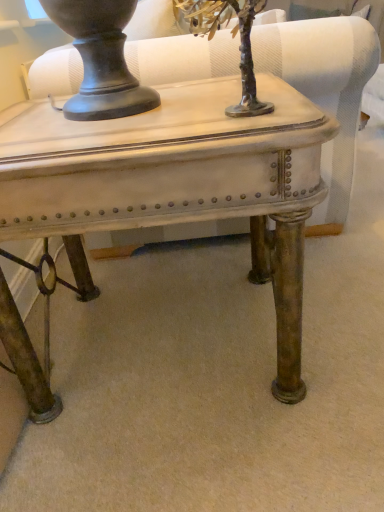
What do you see at coordinates (233, 37) in the screenshot? I see `metallic silver tree at upper center` at bounding box center [233, 37].

I want to click on metallic silver tree at upper center, so click(233, 37).

Is matte white swivel chair at center not close to metallic silver tree at upper center?

Actually, matte white swivel chair at center and metallic silver tree at upper center are a little close together.

From a real-world perspective, which object rests below the other?

matte white swivel chair at center.

From the image's perspective, which is above, matte white swivel chair at center or metallic silver tree at upper center?

From the image's view, matte white swivel chair at center is above.

Measure the distance between matte white swivel chair at center and metallic silver tree at upper center.

matte white swivel chair at center and metallic silver tree at upper center are 11.87 inches apart.

Is metallic silver tree at upper center turned away from matte white table at center?

No, matte white table at center is not at the back of metallic silver tree at upper center.

Is metallic silver tree at upper center not near matte white table at center?

They are positioned close to each other.

Which object is more forward, metallic silver tree at upper center or matte white table at center?

metallic silver tree at upper center is more forward.

I want to click on tree that appears on the right of matte white table at center, so click(x=233, y=37).

Is matte white table at center bigger than metallic silver tree at upper center?

Yes.

Can you tell me how much matte white table at center and metallic silver tree at upper center differ in facing direction?

0.000919 degrees separate the facing orientations of matte white table at center and metallic silver tree at upper center.

Could you tell me if matte white table at center is turned towards metallic silver tree at upper center?

No, matte white table at center is not oriented towards metallic silver tree at upper center.

Is matte white table at center with matte white swivel chair at center?

No, matte white table at center is not with matte white swivel chair at center.

Is matte white table at center spatially inside matte white swivel chair at center, or outside of it?

The correct answer is: outside.

Between matte white table at center and matte white swivel chair at center, which one appears on the right side from the viewer's perspective?

matte white swivel chair at center.

Locate an element on the screen. table below the matte white swivel chair at center (from the image's perspective) is located at coordinates (176, 183).

How far apart are matte white swivel chair at center and matte white table at center?

They are 17.17 inches apart.

Is matte white swivel chair at center shorter than matte white table at center?

Incorrect, the height of matte white swivel chair at center does not fall short of that of matte white table at center.

From the image's perspective, relative to matte white table at center, is matte white swivel chair at center above or below?

From the image's perspective, matte white swivel chair at center appears above matte white table at center.

Is metallic silver tree at upper center positioned with its back to matte white swivel chair at center?

That's not correct — metallic silver tree at upper center is not looking away from matte white swivel chair at center.

Is metallic silver tree at upper center positioned beyond the bounds of matte white swivel chair at center?

metallic silver tree at upper center lies outside matte white swivel chair at center's area.

Between metallic silver tree at upper center and matte white swivel chair at center, which one is positioned behind?

matte white swivel chair at center.

Is point (250, 8) closer or farther from the camera than point (338, 224)?

Clearly, point (250, 8) is closer to the camera than point (338, 224).

Image resolution: width=384 pixels, height=512 pixels. I want to click on tree located below the matte white swivel chair at center (from the image's perspective), so click(233, 37).

Identify the location of tree above the matte white table at center (from the image's perspective). The width and height of the screenshot is (384, 512). (233, 37).

Based on their spatial positions, is matte white swivel chair at center or metallic silver tree at upper center further from matte white table at center?

The object further to matte white table at center is matte white swivel chair at center.

Based on their spatial positions, is metallic silver tree at upper center or matte white swivel chair at center further from matte white table at center?

matte white swivel chair at center is positioned further to the anchor matte white table at center.

Considering their positions, is metallic silver tree at upper center positioned closer to matte white swivel chair at center than matte white table at center?

metallic silver tree at upper center is positioned closer to the anchor matte white swivel chair at center.

Considering their positions, is matte white table at center positioned further to matte white swivel chair at center than metallic silver tree at upper center?

matte white table at center is further to matte white swivel chair at center.

Based on their spatial positions, is matte white swivel chair at center or matte white table at center further from metallic silver tree at upper center?

The object further to metallic silver tree at upper center is matte white swivel chair at center.

Considering their positions, is matte white table at center positioned further to metallic silver tree at upper center than matte white swivel chair at center?

matte white swivel chair at center lies further to metallic silver tree at upper center than the other object.

At what (x,y) coordinates should I click in order to perform the action: click on tree between matte white swivel chair at center and matte white table at center in the vertical direction. Please return your answer as a coordinate pair (x, y). Image resolution: width=384 pixels, height=512 pixels. Looking at the image, I should click on (233, 37).